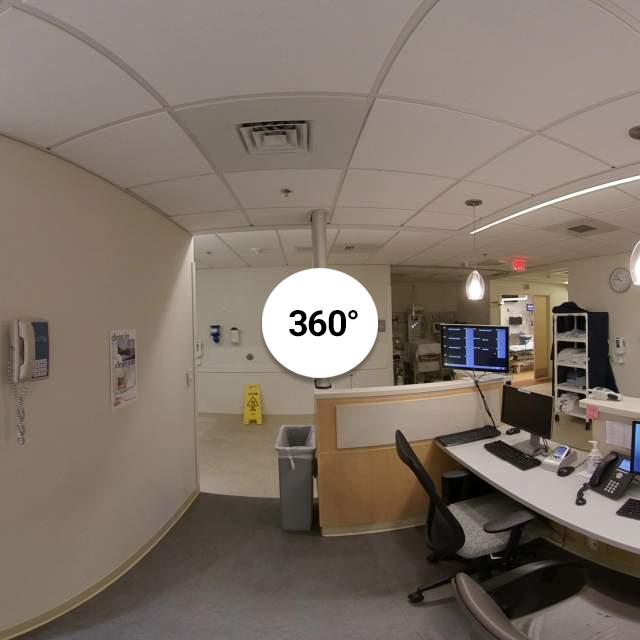
In order to click on exit sign in this screenshot , I will do `click(521, 264)`.